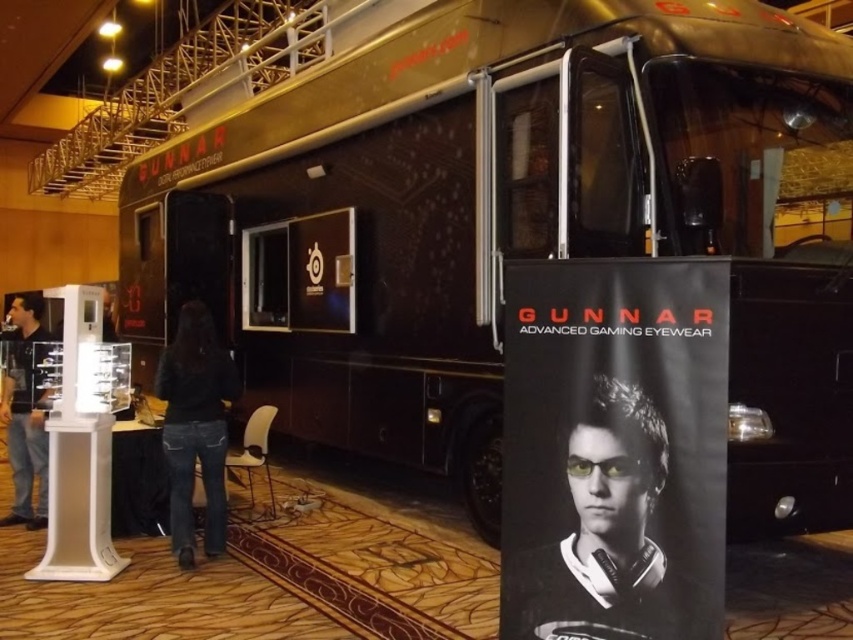
Question: Does matte black poster at center appear on the right side of dark blue jeans at lower center?

Choices:
 (A) no
 (B) yes

Answer: (B)

Question: Observing the image, what is the correct spatial positioning of metallic gold bus at center in reference to matte black poster at center?

Choices:
 (A) above
 (B) below

Answer: (A)

Question: Is matte black poster at center smaller than dark blue jeans at lower center?

Choices:
 (A) no
 (B) yes

Answer: (A)

Question: Based on their relative distances, which object is farther from the dark blue jeans at lower center?

Choices:
 (A) matte black poster at center
 (B) dark blue jeans at left

Answer: (A)

Question: Which of the following is the farthest from the observer?

Choices:
 (A) (374, 177)
 (B) (24, 419)
 (C) (670, 484)
 (D) (216, 483)

Answer: (A)

Question: Which of the following is the farthest from the observer?

Choices:
 (A) (193, 438)
 (B) (514, 592)
 (C) (485, 276)
 (D) (15, 410)

Answer: (D)